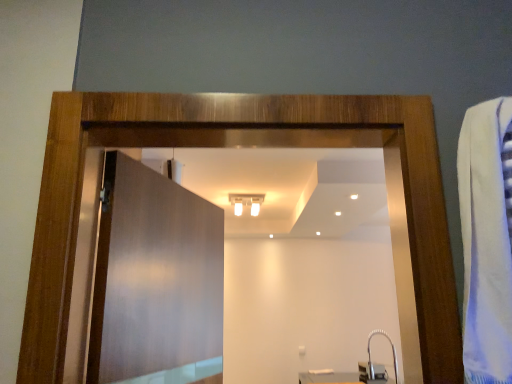
Question: Can you confirm if satin nickel faucet at lower right is taller than matte wood door at center?

Choices:
 (A) no
 (B) yes

Answer: (A)

Question: Could you tell me if satin nickel faucet at lower right is turned towards matte wood door at center?

Choices:
 (A) no
 (B) yes

Answer: (A)

Question: Can you confirm if satin nickel faucet at lower right is wider than matte wood door at center?

Choices:
 (A) no
 (B) yes

Answer: (B)

Question: From a real-world perspective, is satin nickel faucet at lower right over matte wood door at center?

Choices:
 (A) yes
 (B) no

Answer: (B)

Question: Is satin nickel faucet at lower right beside matte wood door at center?

Choices:
 (A) no
 (B) yes

Answer: (A)

Question: Is satin nickel faucet at lower right positioned with its back to matte wood door at center?

Choices:
 (A) no
 (B) yes

Answer: (A)

Question: Is white glossy light fixture at upper center aimed at matte wood door at center?

Choices:
 (A) yes
 (B) no

Answer: (B)

Question: Is there a large distance between white glossy light fixture at upper center and matte wood door at center?

Choices:
 (A) yes
 (B) no

Answer: (A)

Question: From the image's perspective, is white glossy light fixture at upper center over matte wood door at center?

Choices:
 (A) no
 (B) yes

Answer: (B)

Question: From the image's perspective, is white glossy light fixture at upper center below matte wood door at center?

Choices:
 (A) yes
 (B) no

Answer: (B)

Question: From a real-world perspective, is white glossy light fixture at upper center on matte wood door at center?

Choices:
 (A) yes
 (B) no

Answer: (A)

Question: Does white glossy light fixture at upper center touch matte wood door at center?

Choices:
 (A) no
 (B) yes

Answer: (A)

Question: From a real-world perspective, is matte wood door at center on white glossy light fixture at upper center?

Choices:
 (A) no
 (B) yes

Answer: (A)